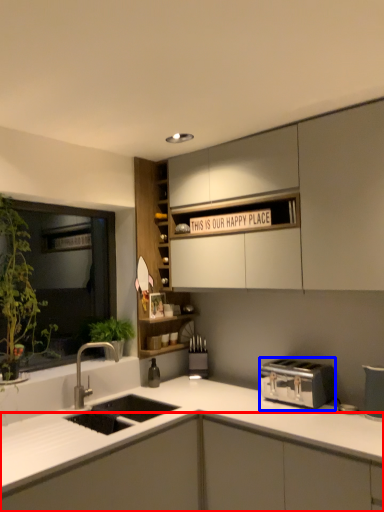
Question: Which object is closer to the camera taking this photo, cabinetry (highlighted by a red box) or toaster (highlighted by a blue box)?

Choices:
 (A) cabinetry
 (B) toaster

Answer: (A)